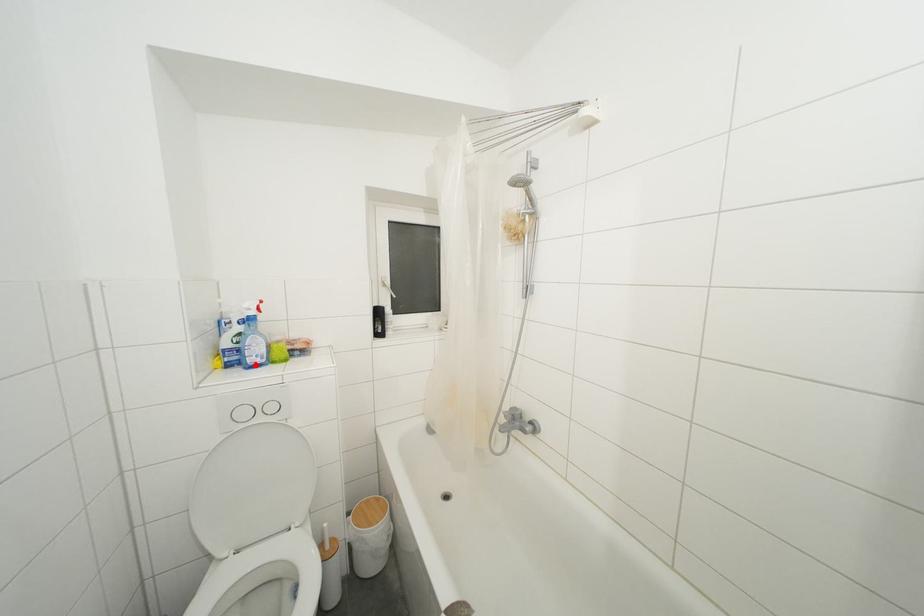
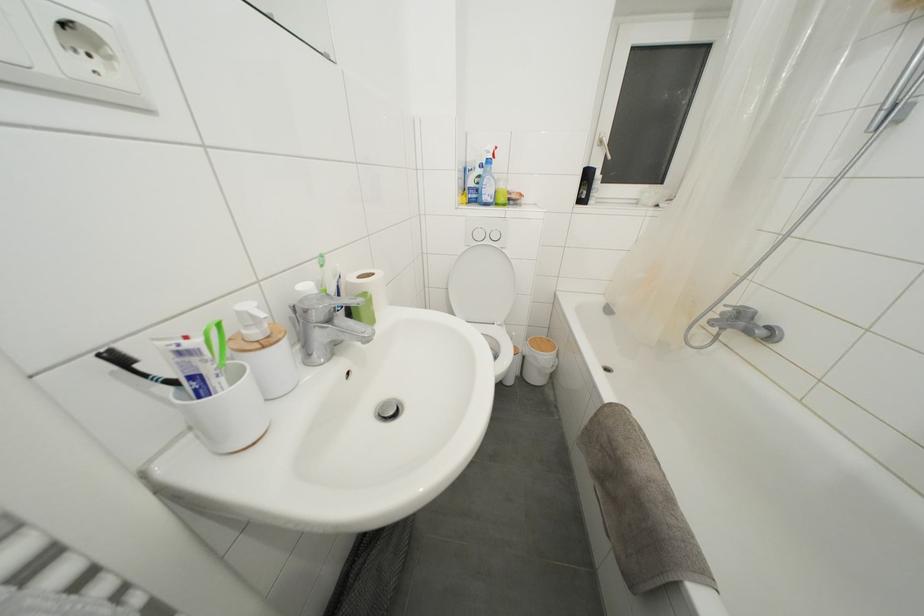
Where in the second image is the point corresponding to the highlighted location from the first image?

(490, 203)